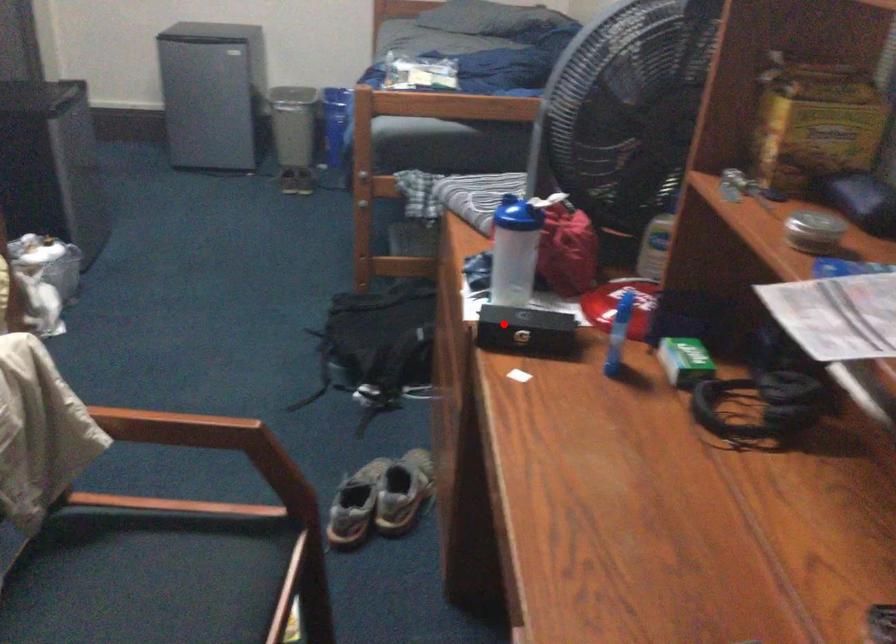
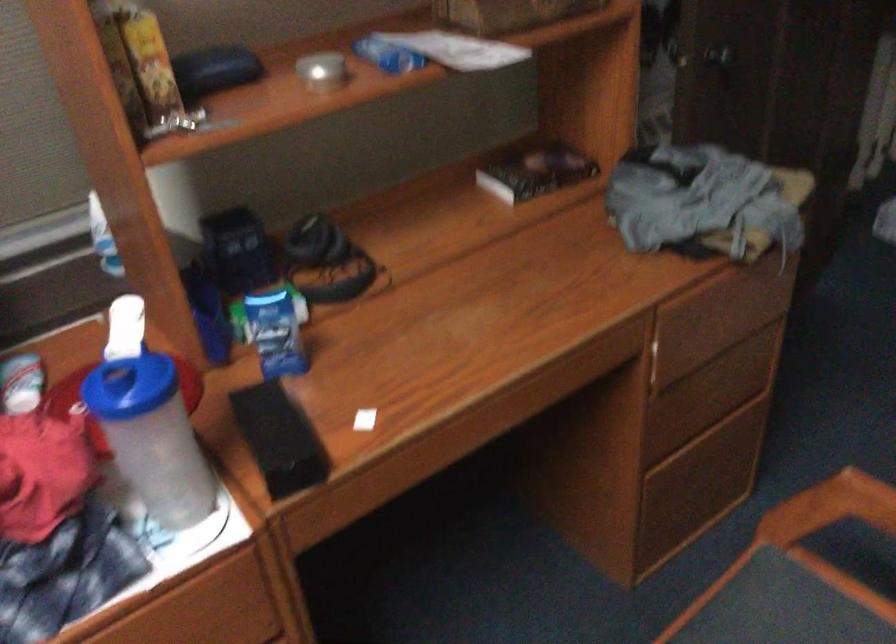
Find the pixel in the second image that matches the highlighted location in the first image.

(279, 438)